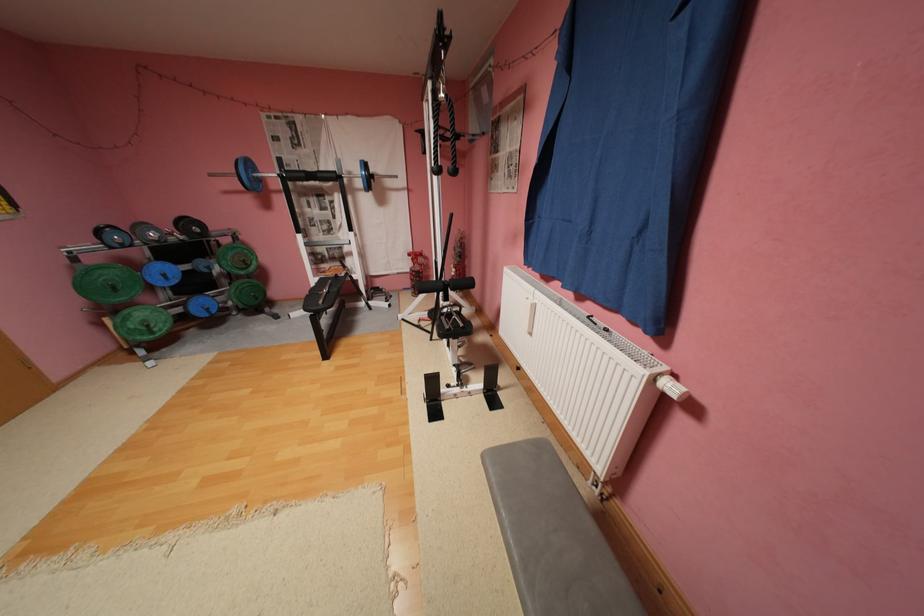
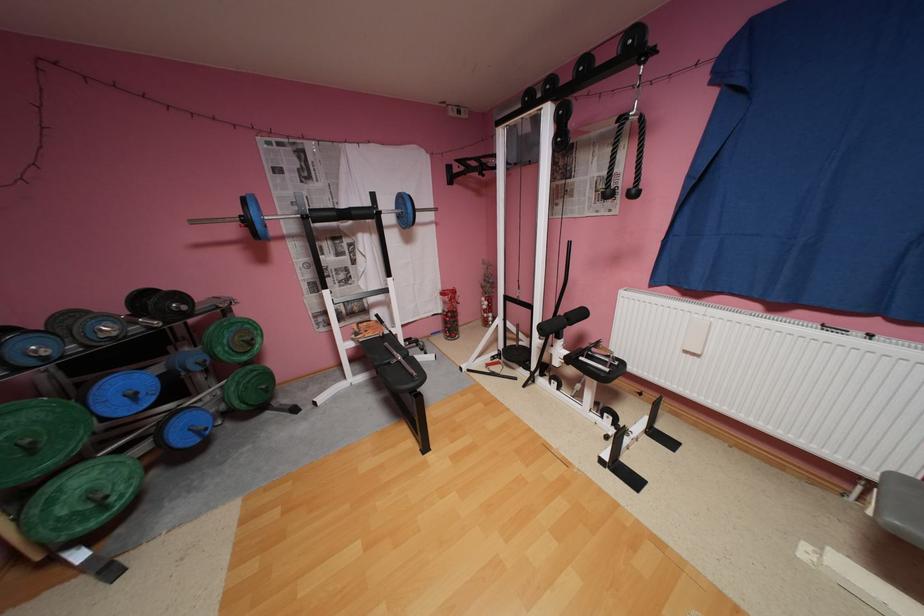
Where in the second image is the point corresponding to point (123, 286) from the first image?

(40, 448)